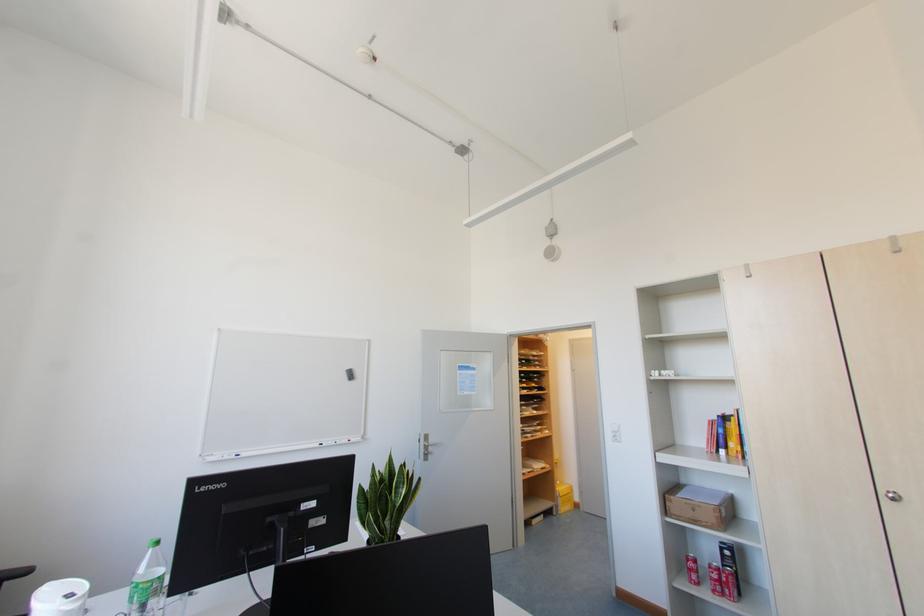
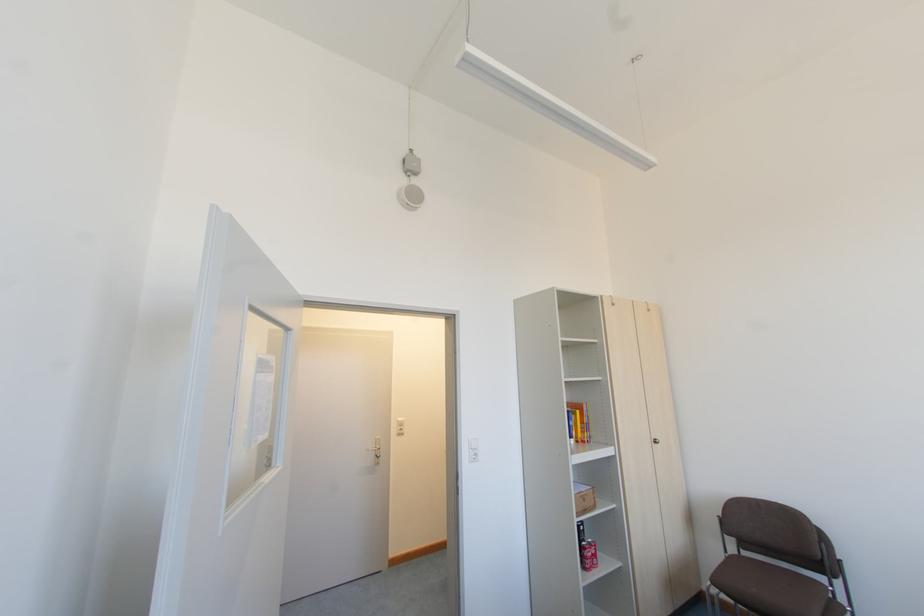
The point at [614,435] is marked in the first image. Where is the corresponding point in the second image?

(472, 453)